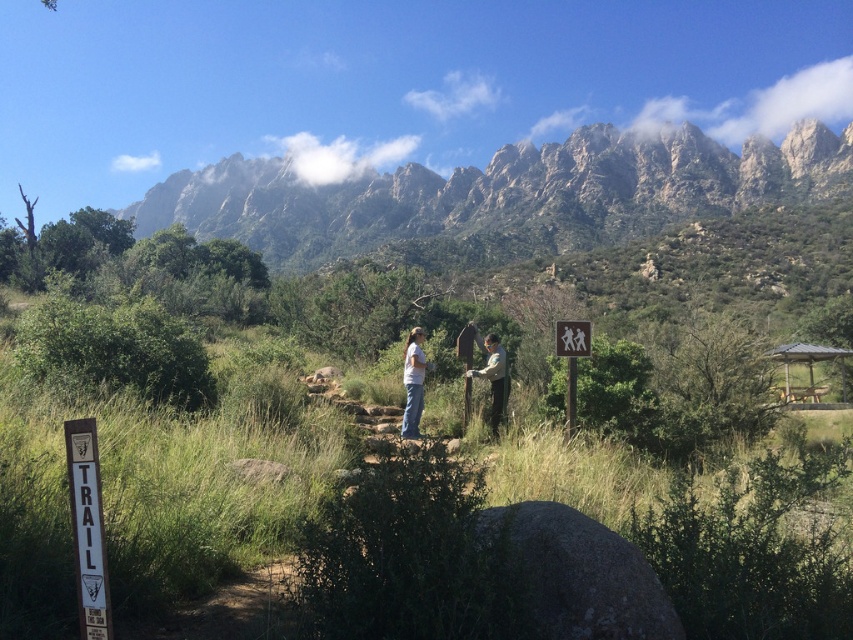
Question: Which object is the closest to the white cotton shirt at center?

Choices:
 (A) rugged rock mountain at upper center
 (B) white wooden sign at lower left
 (C) khaki uniform at center

Answer: (C)

Question: Among these objects, which one is nearest to the camera?

Choices:
 (A) white cotton shirt at center
 (B) rugged rock mountain at upper center
 (C) wooden signpost at center
 (D) white wooden sign at lower left

Answer: (D)

Question: Is rugged rock mountain at upper center behind white cotton shirt at center?

Choices:
 (A) no
 (B) yes

Answer: (B)

Question: Can you confirm if white wooden sign at lower left is thinner than wooden signpost at center?

Choices:
 (A) no
 (B) yes

Answer: (B)

Question: Does khaki uniform at center appear under wooden signpost at center?

Choices:
 (A) no
 (B) yes

Answer: (B)

Question: Considering the real-world distances, which object is closest to the rugged rock mountain at upper center?

Choices:
 (A) white cotton shirt at center
 (B) wooden signpost at center

Answer: (B)